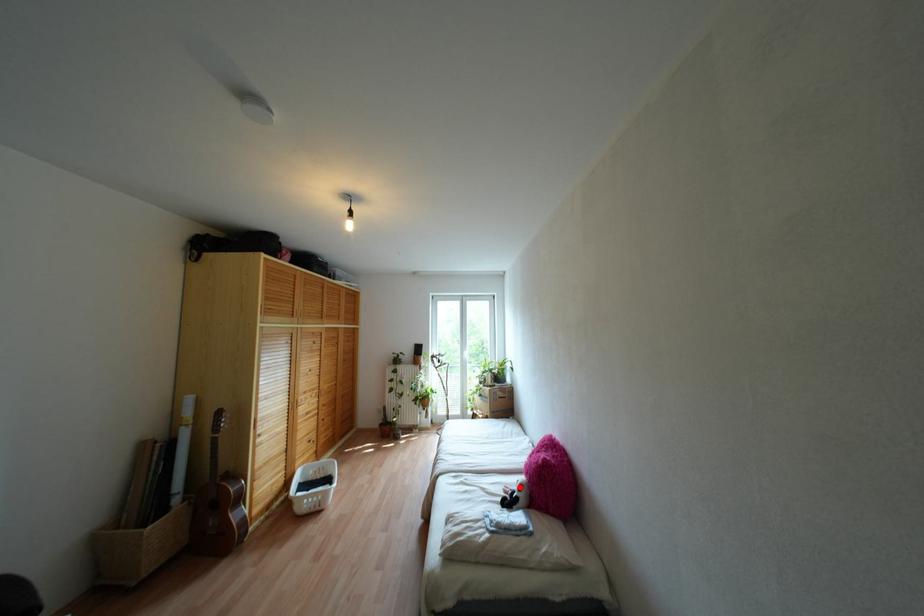
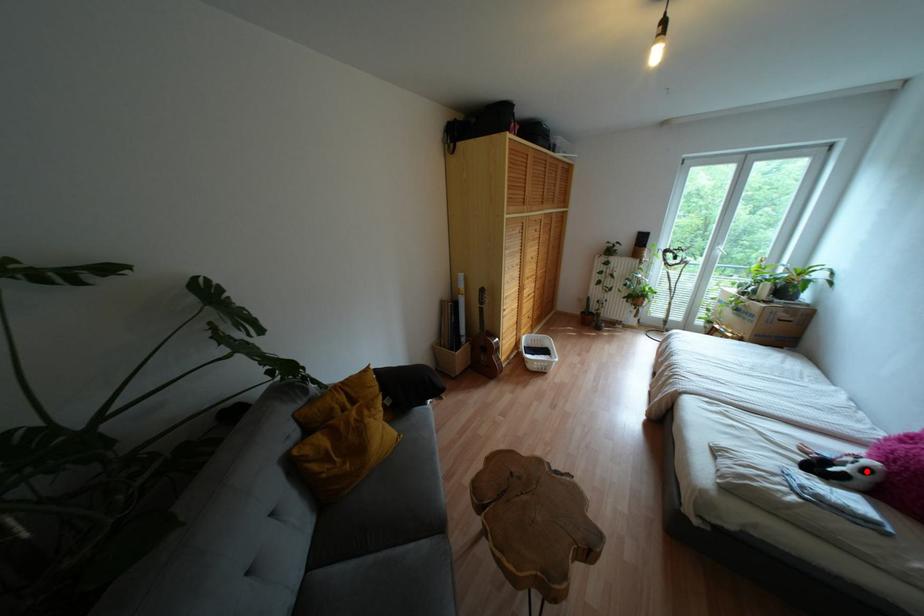
I am providing you with two images of the same scene from different viewpoints. A red point is marked on the first image and another point is marked on the second image. Are the points marked in image1 and image2 representing the same 3D position?

Yes